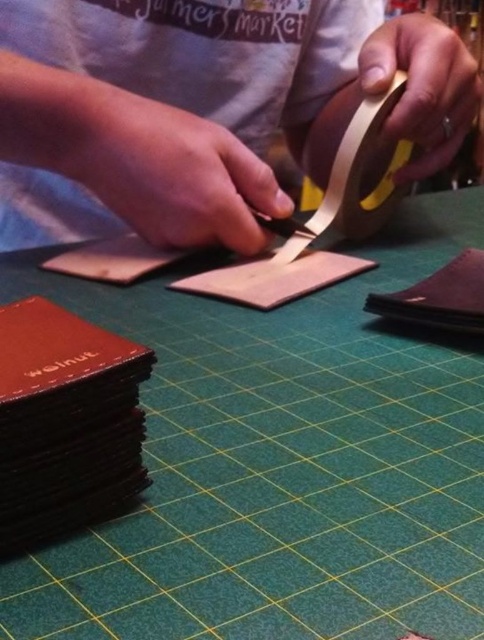
You are a leather craftsman working on a project. You need to place a new tool on the workspace. The workspace has the matte brown leather at center and the gold matte tape at upper right. Which object should you place the tool on to ensure it is closer to the viewer?

You should place the tool on the matte brown leather at center because it is in front of the gold matte tape at upper right, making it closer to the viewer.

You are a beginner leather craftsman and want to measure the distance between your workspace and your eyes to ensure proper ergonomics. The workspace includes the point labeled as point (272, 400). Can you determine if the distance is within the recommended 16 to 20 inches range for comfortable viewing?

The distance between point (272, 400) and the camera is 17.06 inches, which falls within the recommended 16 to 20 inches range for comfortable viewing.

You are a leather craftsman working on a project. You need to place a new piece of matte brown leather at center onto the workspace. Where should you place it relative to the gold matte tape at upper right?

The matte brown leather at center should be placed above the gold matte tape at upper right.